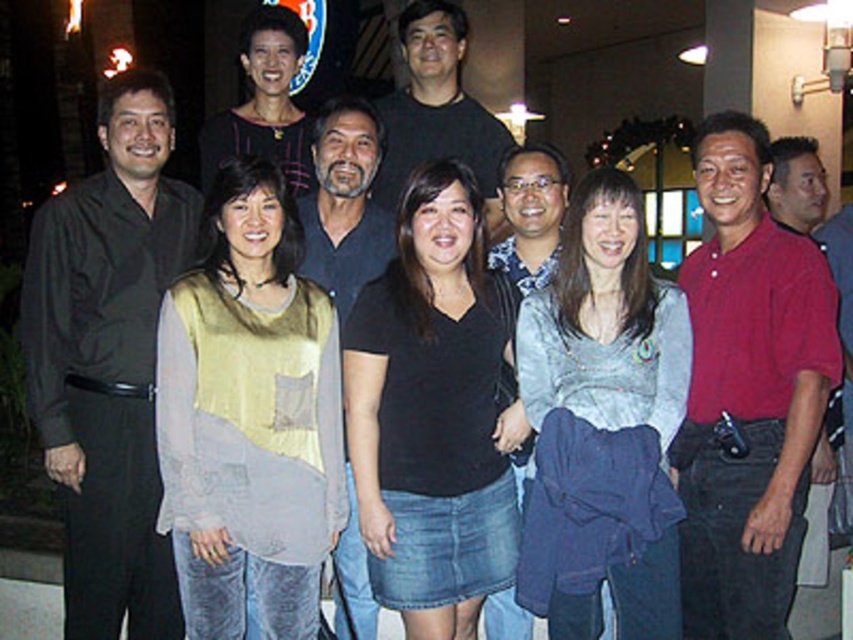
Between black smooth shirt at left and black matte shirt at center, which one has more height?

Standing taller between the two is black smooth shirt at left.

Is point (173, 593) positioned after point (511, 538)?

Yes, point (173, 593) is behind point (511, 538).

Find the location of a particular element. This screenshot has height=640, width=853. black smooth shirt at left is located at coordinates (108, 360).

Is point (381, 410) closer to camera compared to point (433, 52)?

That is True.

Find the location of a particular element. The height and width of the screenshot is (640, 853). black matte shirt at center is located at coordinates (432, 416).

Looking at this image, can you confirm if light gray cotton shirt at center is positioned to the left of black matte shirt at center?

In fact, light gray cotton shirt at center is to the right of black matte shirt at center.

Between point (596, 369) and point (442, 490), which one is positioned behind?

The point (442, 490) is more distant.

The width and height of the screenshot is (853, 640). What do you see at coordinates (602, 424) in the screenshot?
I see `light gray cotton shirt at center` at bounding box center [602, 424].

Where is `light gray cotton shirt at center`? light gray cotton shirt at center is located at coordinates (602, 424).